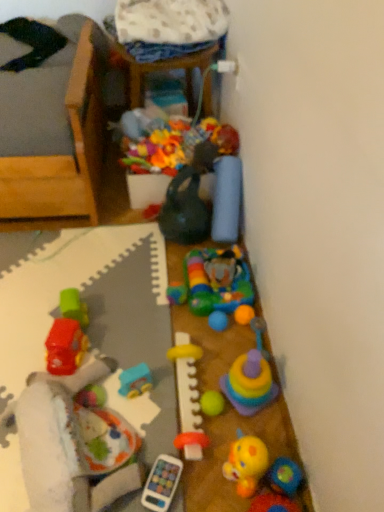
Image resolution: width=384 pixels, height=512 pixels. Identify the location of free space that is in between yellow rubber teething ring at center, positioned as the eighth toy in right-to-left order, and rubber duck at center, the fifth toy from the right. (218, 426).